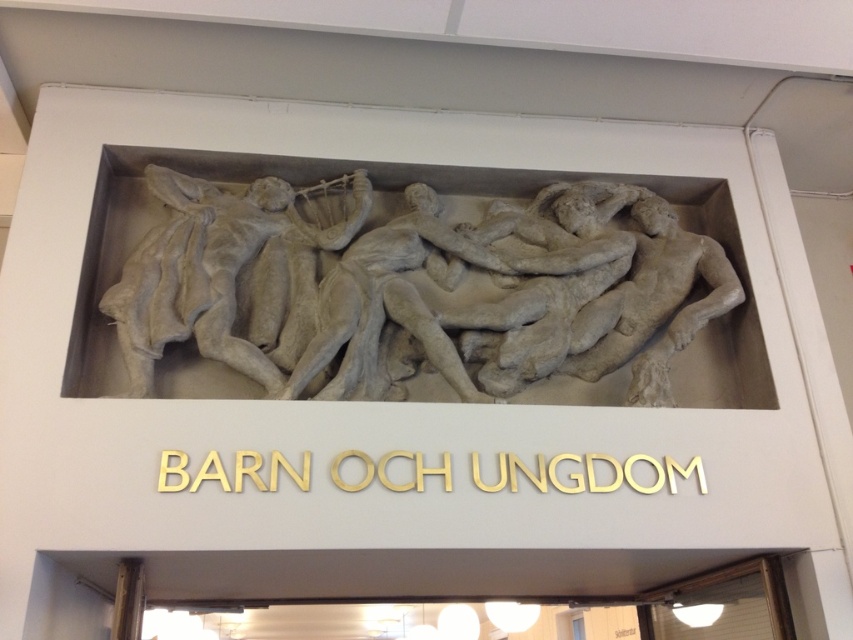
Question: Which point is farther from the camera taking this photo?

Choices:
 (A) (260, 225)
 (B) (177, 176)

Answer: (B)

Question: Does white stone relief at center have a larger size compared to gray stone sculpture at center?

Choices:
 (A) no
 (B) yes

Answer: (B)

Question: Is white stone relief at center behind gray stone sculpture at center?

Choices:
 (A) yes
 (B) no

Answer: (A)

Question: Is white stone relief at center above gray stone sculpture at center?

Choices:
 (A) yes
 (B) no

Answer: (B)